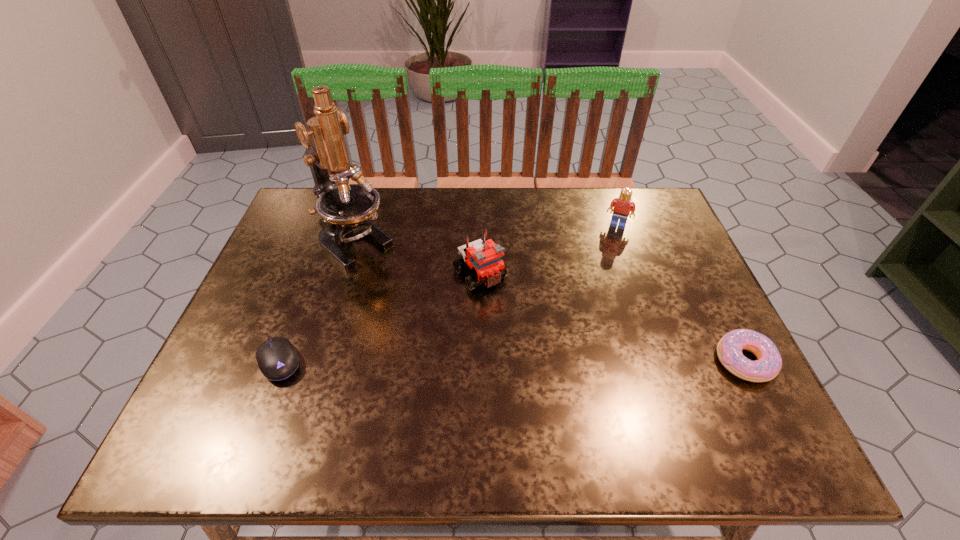
You are a GUI agent. You are given a task and a screenshot of the screen. Output one action in this format:
    pyautogui.click(x=<x>, y=<y>)
    Task: Click on the free location located 0.380m at the eyepiece of the tallest object
    This screenshot has width=960, height=540.
    Given the screenshot: What is the action you would take?
    pyautogui.click(x=475, y=347)

Identify the location of free space located at the eyepiece of the tallest object. (443, 320).

Where is `free space located 0.330m at the eyepiece of the tallest object`? free space located 0.330m at the eyepiece of the tallest object is located at coordinates [x=460, y=335].

Identify the location of vacant point located 0.250m on the front-facing side of the left Lego. This screenshot has height=540, width=960. (554, 364).

This screenshot has height=540, width=960. Identify the location of free space located on the front-facing side of the left Lego. (543, 352).

The height and width of the screenshot is (540, 960). I want to click on vacant space located on the front-facing side of the left Lego, so click(516, 318).

Find the location of `vacant space situated 0.250m on the front-facing side of the fourth object from left to right`. vacant space situated 0.250m on the front-facing side of the fourth object from left to right is located at coordinates (593, 286).

Identify the location of vacant point located 0.350m on the front-facing side of the fourth object from left to right. The width and height of the screenshot is (960, 540). (584, 314).

The height and width of the screenshot is (540, 960). Identify the location of vacant region located 0.290m on the front-facing side of the fourth object from left to right. (589, 297).

Where is `microscope present at the far edge`? microscope present at the far edge is located at coordinates (344, 208).